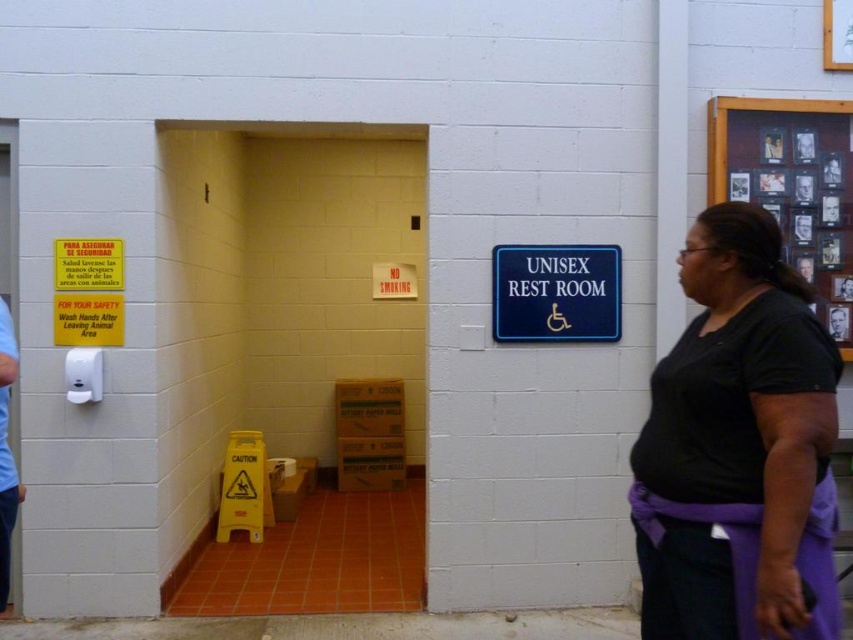
You are standing in the restroom and see the light blue fabric at left and the dark brown hair at upper left. Which object is positioned lower in the scene?

The light blue fabric at left is located below dark brown hair at upper left, so the light blue fabric at left is positioned lower in the scene.

From the picture: You are a maintenance worker who needs to reach both the blue plastic sign at upper right and the dark brown hair at upper left. Which object is closer to you?

The blue plastic sign at upper right is 3.98 feet away from the dark brown hair at upper left. Since the question asks which is closer to you, but the distance between them is given, not their individual distances from you, the answer cannot be determined with the provided information.

You are standing in the restroom area and need to locate two specific points marked in the image. Which point, point (569, 300) or point (831, 314), is closer to you?

Point (569, 300) is closer to the viewer than point (831, 314).